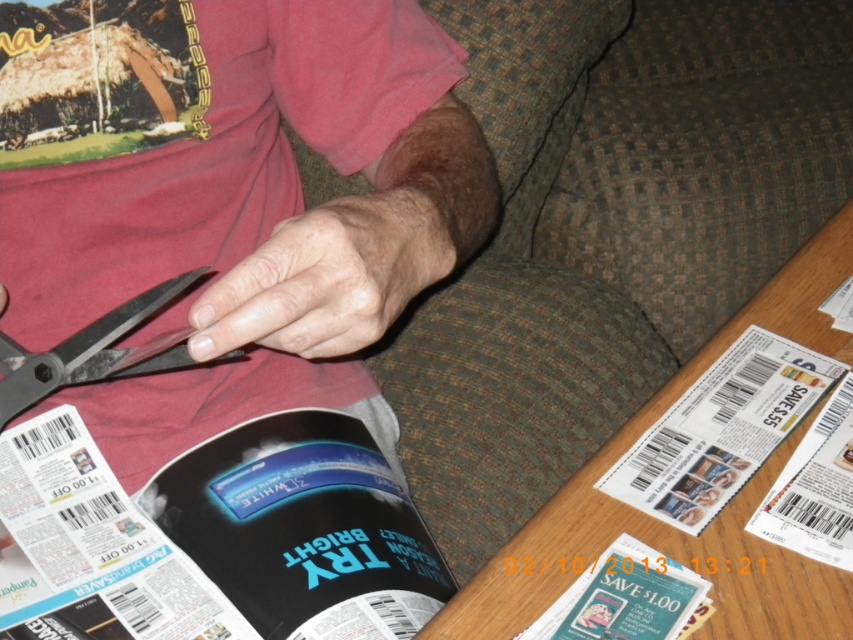
You are a coupon collector trying to locate the white glossy coupon at lower right. According to the image coordinates, where exactly is it located?

The white glossy coupon at lower right is located at point [720,429].

You are a skincare expert analyzing the image. You notice the dry skin at center and the matte black magazine at lower center. Which object is wider?

The dry skin at center might be wider than matte black magazine at lower center.